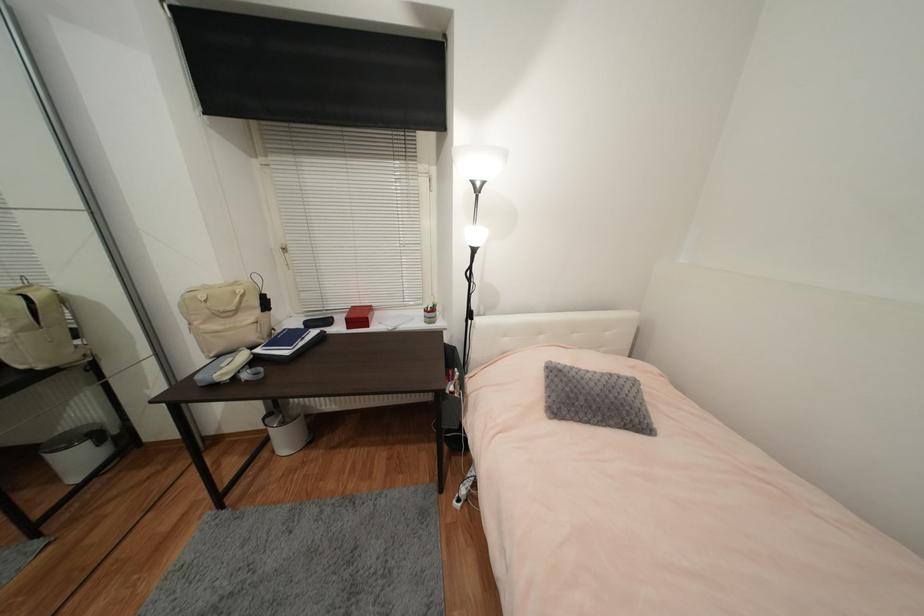
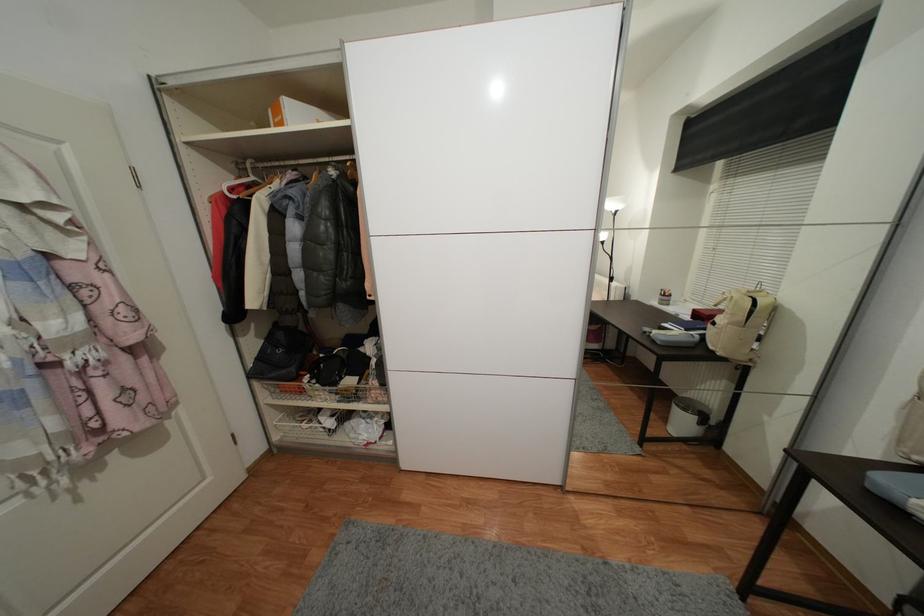
The images are taken continuously from a first-person perspective. In which direction is your viewpoint rotating?

The rotation direction of the camera is left-down.